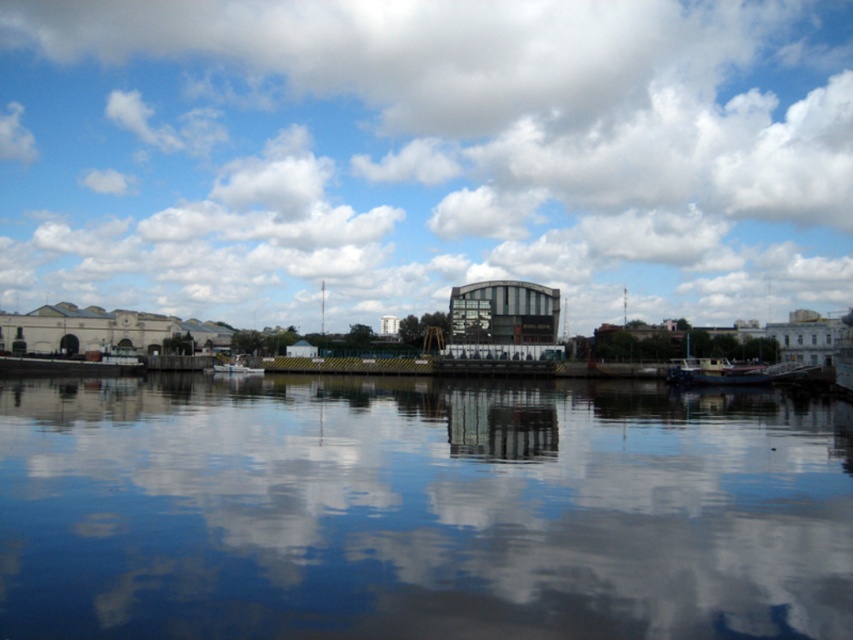
Can you confirm if wooden boat at right is positioned to the right of white matte boat at center?

Correct, you'll find wooden boat at right to the right of white matte boat at center.

Is wooden boat at right above white matte boat at center?

Yes, wooden boat at right is above white matte boat at center.

Where is `wooden boat at right`? wooden boat at right is located at coordinates (715, 372).

Find the location of `wooden boat at right`. wooden boat at right is located at coordinates (715, 372).

Who is more distant from viewer, (x=635, y=164) or (x=761, y=32)?

Point (x=761, y=32)

Who is taller, cloudy sky at upper center or white fluffy cloud at upper center?

cloudy sky at upper center

In the scene shown: Who is more forward, [787,113] or [155,19]?

Point [787,113] is more forward.

Identify the location of cloudy sky at upper center. (425, 154).

Consider the image. Does cloudy sky at upper center lie behind transparent glass water at center?

Yes, it is behind transparent glass water at center.

Is cloudy sky at upper center wider than transparent glass water at center?

Yes, cloudy sky at upper center is wider than transparent glass water at center.

Between point (337, 234) and point (173, 429), which one is positioned in front?

Positioned in front is point (173, 429).

Locate an element on the screen. Image resolution: width=853 pixels, height=640 pixels. cloudy sky at upper center is located at coordinates (425, 154).